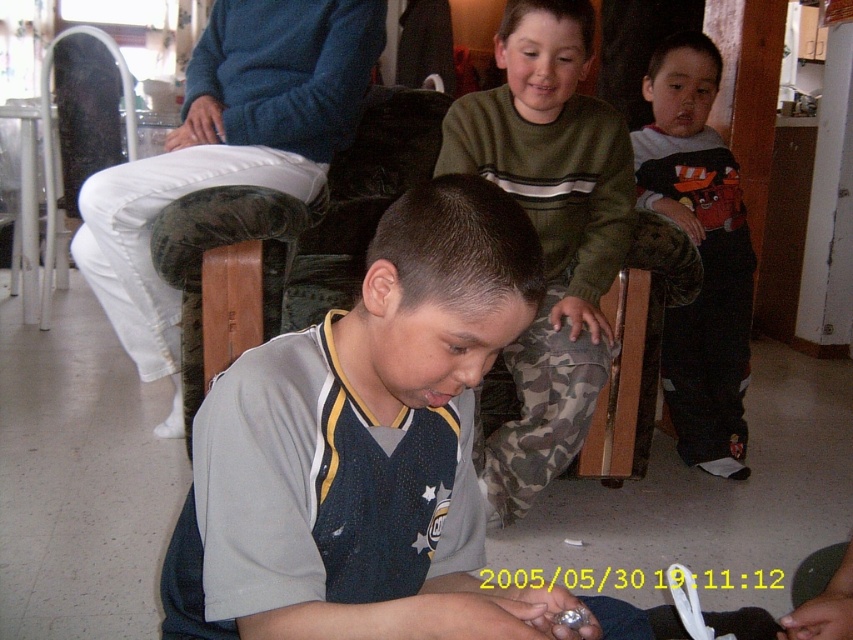
Can you confirm if green sweater at upper center is positioned to the right of blue fleece sweater at upper center?

Indeed, green sweater at upper center is positioned on the right side of blue fleece sweater at upper center.

Is point (467, 115) positioned in front of point (149, 204)?

No.

Where is `green sweater at upper center`? This screenshot has width=853, height=640. green sweater at upper center is located at coordinates (548, 234).

Does gray mesh shirt at center have a smaller size compared to blue fleece sweater at upper center?

Yes.

The height and width of the screenshot is (640, 853). Describe the element at coordinates (364, 449) in the screenshot. I see `gray mesh shirt at center` at that location.

What do you see at coordinates (364, 449) in the screenshot? I see `gray mesh shirt at center` at bounding box center [364, 449].

At what (x,y) coordinates should I click in order to perform the action: click on gray mesh shirt at center. Please return your answer as a coordinate pair (x, y). The width and height of the screenshot is (853, 640). Looking at the image, I should click on (364, 449).

Is gray mesh shirt at center below dark gray sweater at upper right?

Correct, gray mesh shirt at center is located below dark gray sweater at upper right.

Does point (175, 614) lie behind point (672, 88)?

No, (175, 614) is in front of (672, 88).

Which is behind, point (334, 612) or point (717, 269)?

The point (717, 269) is more distant.

Where is `gray mesh shirt at center`? This screenshot has width=853, height=640. gray mesh shirt at center is located at coordinates (364, 449).